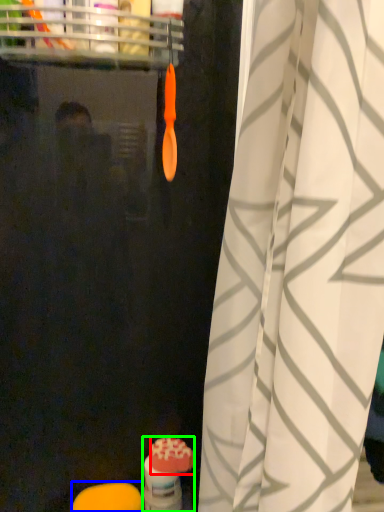
Question: Which is farther away from soap (highlighted by a red box)? soap (highlighted by a blue box) or toiletry (highlighted by a green box)?

Choices:
 (A) soap
 (B) toiletry

Answer: (A)